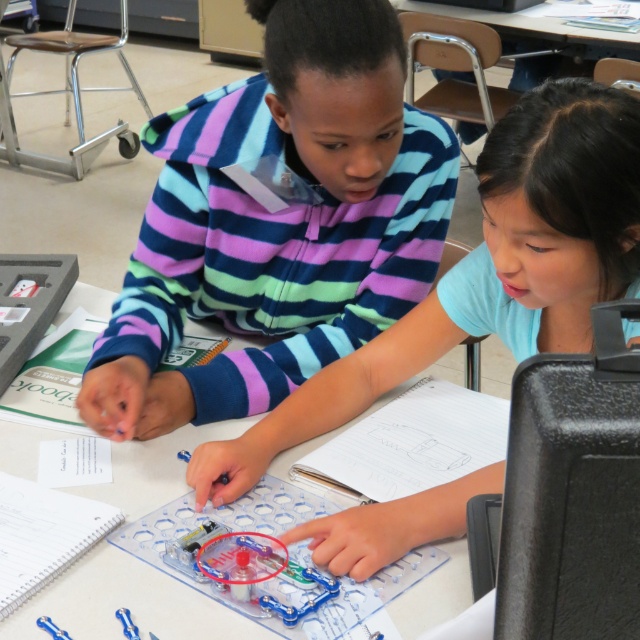
Which of these two, striped fleece at center or matte plastic toy at center, stands taller?

Standing taller between the two is striped fleece at center.

Does striped fleece at center have a greater width compared to matte plastic toy at center?

In fact, striped fleece at center might be narrower than matte plastic toy at center.

Is point (378, 74) closer to camera compared to point (432, 516)?

That is False.

This screenshot has width=640, height=640. In order to click on striped fleece at center in this screenshot , I will do `click(276, 224)`.

Can you confirm if matte plastic toy at center is bigger than clear plastic table at center?

Correct, matte plastic toy at center is larger in size than clear plastic table at center.

Who is positioned more to the left, matte plastic toy at center or clear plastic table at center?

clear plastic table at center is more to the left.

The height and width of the screenshot is (640, 640). Describe the element at coordinates (488, 269) in the screenshot. I see `matte plastic toy at center` at that location.

Locate an element on the screen. matte plastic toy at center is located at coordinates (488, 269).

Which is below, striped fleece at center or clear plastic table at center?

clear plastic table at center

What do you see at coordinates (276, 224) in the screenshot?
I see `striped fleece at center` at bounding box center [276, 224].

Which is behind, point (236, 132) or point (176, 472)?

Point (236, 132)

Find the location of a particular element. striped fleece at center is located at coordinates (276, 224).